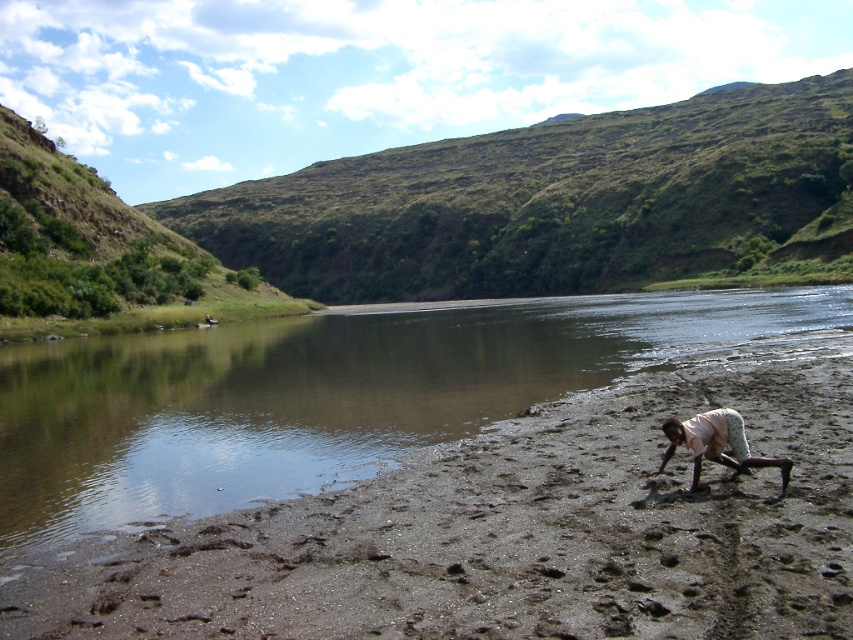
Is brown sandy beach at lower right positioned before light beige fabric squat at lower right?

Yes, it is in front of light beige fabric squat at lower right.

Is brown sandy beach at lower right bigger than light beige fabric squat at lower right?

Yes, brown sandy beach at lower right is bigger than light beige fabric squat at lower right.

Does point (491, 492) come in front of point (669, 456)?

Yes, point (491, 492) is in front of point (669, 456).

Where is `brown sandy beach at lower right`? The image size is (853, 640). brown sandy beach at lower right is located at coordinates (509, 536).